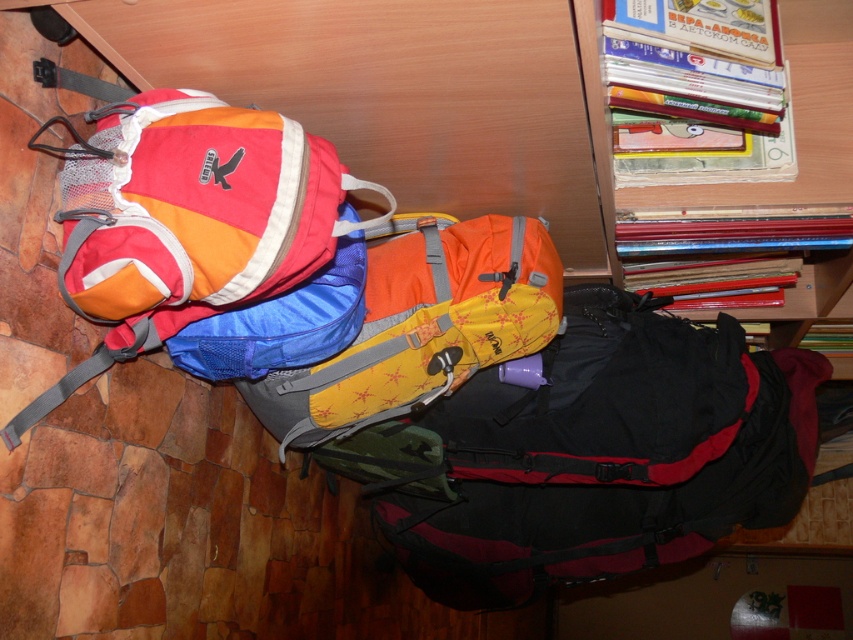
You are organizing a storage area and need to place a new item between the yellow fabric backpack at center and the hardcover book at upper right. Which object should you move to create space?

You should move the yellow fabric backpack at center because it is closer to you than the hardcover book at upper right, so moving it would create space between them.

You are organizing a storage room and need to place the matte black backpack at center and the wooden bookshelf at upper right side by side. Based on their widths, which one requires more horizontal space?

The matte black backpack at center requires more horizontal space because its width surpasses that of the wooden bookshelf at upper right.

You are organizing a storage room and need to retrieve the hardcover book at upper right. There is a yellow fabric backpack at center blocking your path. Can you move the backpack to access the book?

The yellow fabric backpack at center is located below the hardcover book at upper right, so you can access the book without moving the backpack since it is above it.